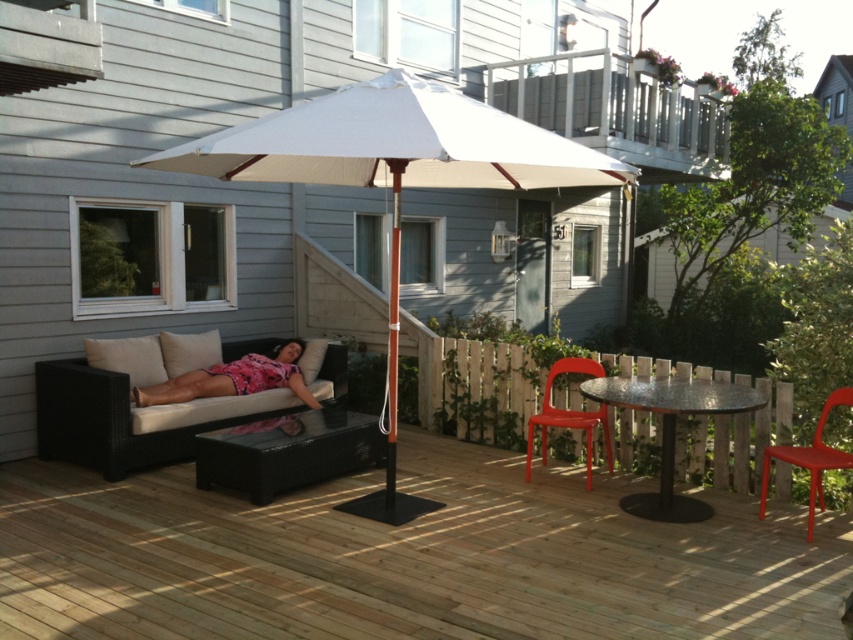
Question: Which point appears farthest from the camera in this image?

Choices:
 (A) (564, 410)
 (B) (662, 481)
 (C) (422, 150)

Answer: (A)

Question: Which point is closer to the camera?

Choices:
 (A) (677, 515)
 (B) (827, 413)

Answer: (A)

Question: Which point is farther to the camera?

Choices:
 (A) (393, 326)
 (B) (550, 417)
 (C) (305, 497)

Answer: (B)

Question: Observing the image, what is the correct spatial positioning of red plastic chair at lower right in reference to matte plastic chair at center?

Choices:
 (A) left
 (B) right

Answer: (B)

Question: Considering the relative positions of wooden deck at center and red plastic chair at lower right in the image provided, where is wooden deck at center located with respect to red plastic chair at lower right?

Choices:
 (A) above
 (B) below

Answer: (B)

Question: Is black wicker couch at lower left positioned in front of red plastic chair at lower right?

Choices:
 (A) no
 (B) yes

Answer: (A)